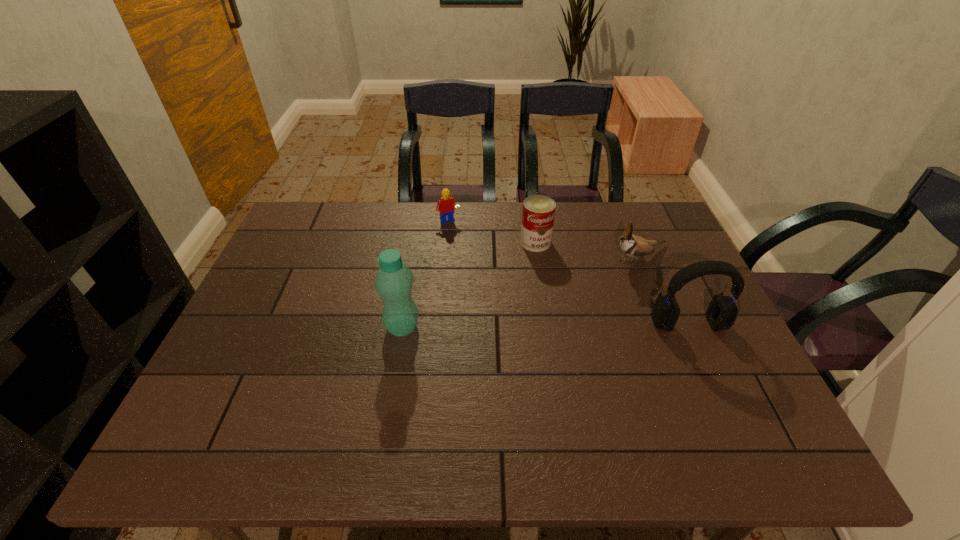
Locate an element on the screen. free spot on the desktop that is between the bottle and the fourth shortest object and is positioned at the face of the bird is located at coordinates (509, 326).

Find the location of `vacant space on the desktop that is between the leftmost object and the headset and is positioned on the front label of the third object from right to left`. vacant space on the desktop that is between the leftmost object and the headset and is positioned on the front label of the third object from right to left is located at coordinates (555, 326).

The width and height of the screenshot is (960, 540). In order to click on free space on the desktop that is between the leftmost object and the fourth shortest object and is positioned on the front-facing side of the Lego in this screenshot , I will do `click(525, 326)`.